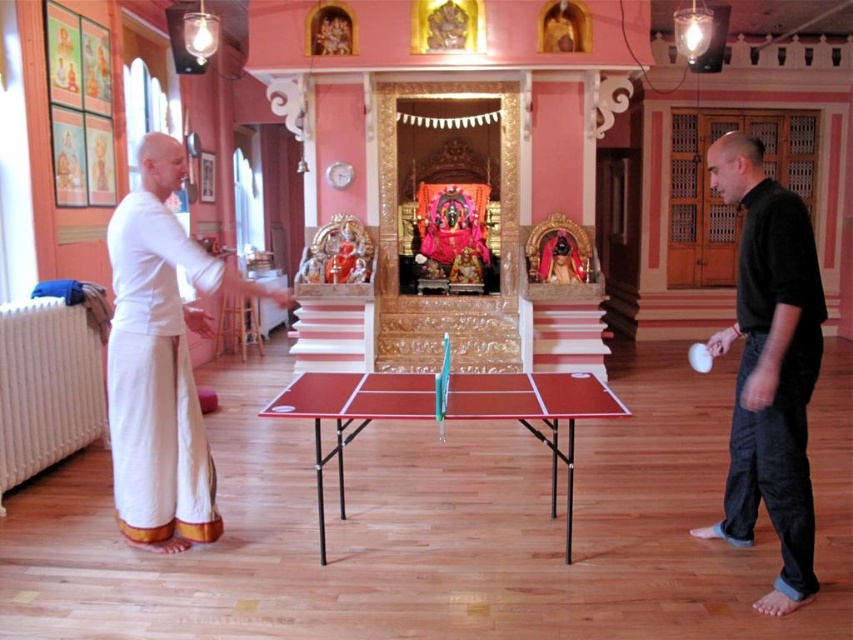
Find the location of a particular element. The width and height of the screenshot is (853, 640). black cotton shirt at right is located at coordinates (769, 365).

Where is `black cotton shirt at right`? The image size is (853, 640). black cotton shirt at right is located at coordinates (769, 365).

Does point (204, 529) come in front of point (698, 365)?

Yes, point (204, 529) is in front of point (698, 365).

Does white cotton robe at left have a smaller size compared to white rubber table tennis ball at center?

Yes.

Measure the distance between white cotton robe at left and camera.

9.66 feet

I want to click on white cotton robe at left, so click(155, 380).

Where is `red plastic table at center`? The height and width of the screenshot is (640, 853). red plastic table at center is located at coordinates [x=537, y=412].

Based on the photo, who is taller, red plastic table at center or white rubber table tennis ball at center?

red plastic table at center is taller.

This screenshot has height=640, width=853. In order to click on red plastic table at center in this screenshot , I will do `click(537, 412)`.